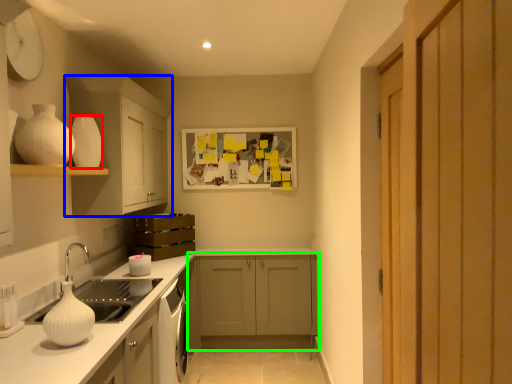
Question: Which object is positioned farthest from vase (highlighted by a red box)? Select from cabinetry (highlighted by a blue box) and cabinetry (highlighted by a green box).

Choices:
 (A) cabinetry
 (B) cabinetry

Answer: (B)